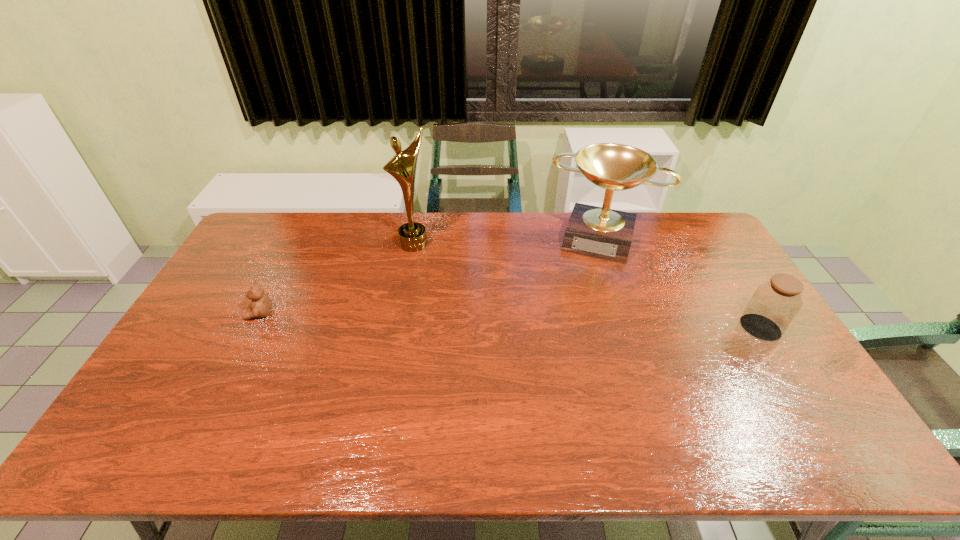
Where is `teddy bear`? This screenshot has height=540, width=960. teddy bear is located at coordinates (261, 305).

The image size is (960, 540). In order to click on the shortest object in this screenshot , I will do `click(261, 305)`.

The height and width of the screenshot is (540, 960). What are the coordinates of `the third tallest object` in the screenshot? It's located at (774, 304).

At what (x,y) coordinates should I click in order to perform the action: click on jar. Please return your answer as a coordinate pair (x, y). Looking at the image, I should click on (774, 304).

Where is `the taller award`? the taller award is located at coordinates (412, 236).

The height and width of the screenshot is (540, 960). I want to click on the tallest object, so click(x=412, y=236).

You are a GUI agent. You are given a task and a screenshot of the screen. Output one action in this format:
    pyautogui.click(x=<x>, y=<y>)
    Task: Click on the second tallest object
    
    Given the screenshot: What is the action you would take?
    point(599,232)

At what (x,y) coordinates should I click in order to perform the action: click on the second object from right to left. Please return your answer as a coordinate pair (x, y). Image resolution: width=960 pixels, height=540 pixels. Looking at the image, I should click on (599, 232).

I want to click on vacant area located 0.050m on the face of the leftmost object, so click(x=230, y=314).

I want to click on vacant position located 0.090m on the face of the leftmost object, so click(217, 314).